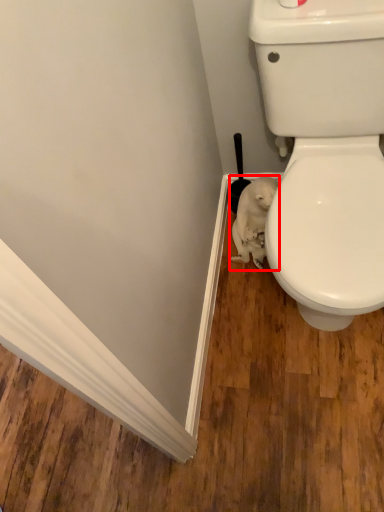
Question: From the image's perspective, what is the correct spatial positioning of animal (annotated by the red box) in reference to brush?

Choices:
 (A) above
 (B) below

Answer: (B)